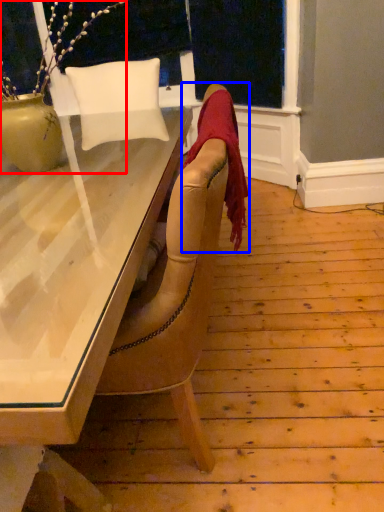
Question: Which point is closer to the camera, houseplant (highlighted by a red box) or blanket (highlighted by a blue box)?

Choices:
 (A) houseplant
 (B) blanket

Answer: (A)